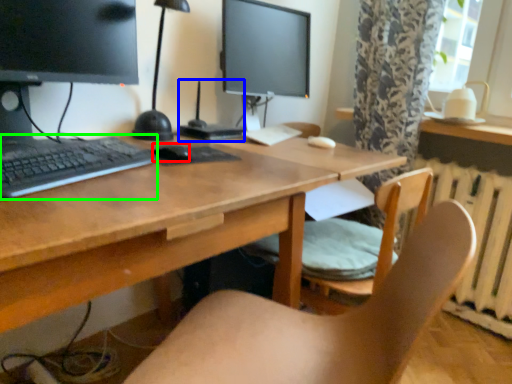
Question: Which object is positioned closest to mouse (highlighted by a red box)? Select from computer (highlighted by a blue box) and computer keyboard (highlighted by a green box).

Choices:
 (A) computer
 (B) computer keyboard

Answer: (B)